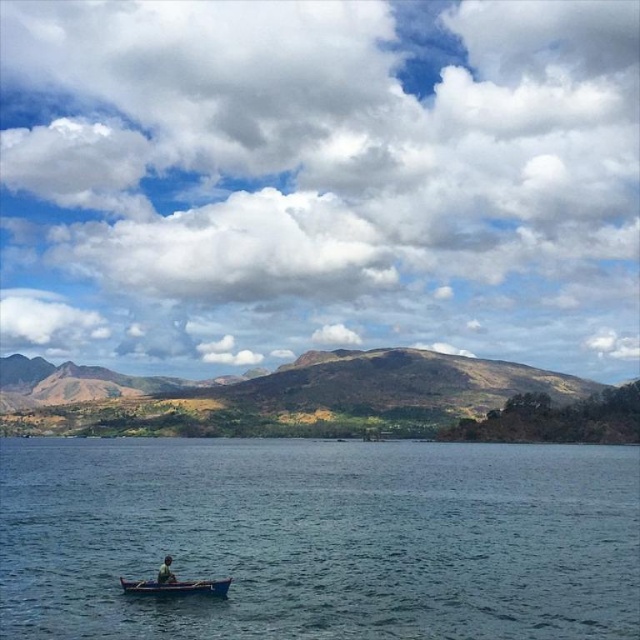
You are standing on the shore and see the blue fabric person at lower left and the blue water at center. Which object is closer to your left side?

The blue water at center is closer to your left side because it is positioned to the left of the blue fabric person at lower left.

You are standing on the shore and want to board the blue wooden canoe at lower center. Based on the scene, can you determine if the blue water at center is higher or lower than the canoe?

The blue water at center is taller than the blue wooden canoe at lower center, so the water is higher than the canoe.

You are standing on the dock and see the blue wooden canoe at lower center and the blue fabric person at lower left. Which object is closer to you?

The blue wooden canoe at lower center is closer to you because it is positioned under the blue fabric person at lower left, indicating it is in front.